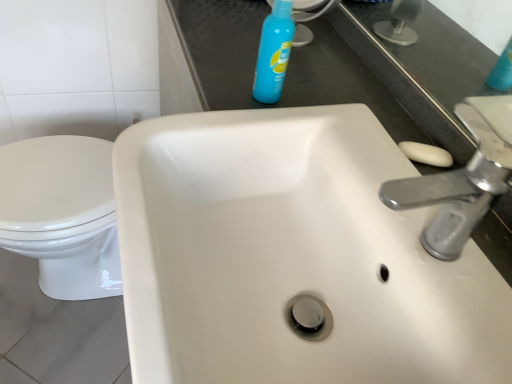
Question: Does blue plastic spray bottle at upper center have a lesser width compared to silver metallic faucet at upper right?

Choices:
 (A) yes
 (B) no

Answer: (A)

Question: Does blue plastic spray bottle at upper center have a smaller size compared to silver metallic faucet at upper right?

Choices:
 (A) no
 (B) yes

Answer: (B)

Question: Could you tell me if blue plastic spray bottle at upper center is turned towards silver metallic faucet at upper right?

Choices:
 (A) no
 (B) yes

Answer: (A)

Question: From the image's perspective, is blue plastic spray bottle at upper center beneath silver metallic faucet at upper right?

Choices:
 (A) no
 (B) yes

Answer: (A)

Question: Is blue plastic spray bottle at upper center at the right side of silver metallic faucet at upper right?

Choices:
 (A) yes
 (B) no

Answer: (B)

Question: In terms of size, does white ceramic sink at center appear bigger or smaller than white glossy toilet at lower left?

Choices:
 (A) big
 (B) small

Answer: (B)

Question: Is point (342, 355) closer or farther from the camera than point (108, 273)?

Choices:
 (A) farther
 (B) closer

Answer: (B)

Question: Is white ceramic sink at center inside the boundaries of white glossy toilet at lower left, or outside?

Choices:
 (A) inside
 (B) outside

Answer: (B)

Question: In terms of height, does white ceramic sink at center look taller or shorter compared to white glossy toilet at lower left?

Choices:
 (A) tall
 (B) short

Answer: (B)

Question: In terms of height, does blue plastic spray bottle at upper center look taller or shorter compared to white ceramic sink at center?

Choices:
 (A) tall
 (B) short

Answer: (B)

Question: Is blue plastic spray bottle at upper center situated inside white ceramic sink at center or outside?

Choices:
 (A) inside
 (B) outside

Answer: (B)

Question: Considering the relative positions of blue plastic spray bottle at upper center and white ceramic sink at center in the image provided, is blue plastic spray bottle at upper center to the left or to the right of white ceramic sink at center?

Choices:
 (A) left
 (B) right

Answer: (A)

Question: Relative to white ceramic sink at center, is blue plastic spray bottle at upper center in front or behind?

Choices:
 (A) behind
 (B) front

Answer: (A)

Question: Is point (439, 190) closer or farther from the camera than point (153, 307)?

Choices:
 (A) closer
 (B) farther

Answer: (B)

Question: Is silver metallic faucet at upper right to the left or to the right of white ceramic sink at center in the image?

Choices:
 (A) right
 (B) left

Answer: (A)